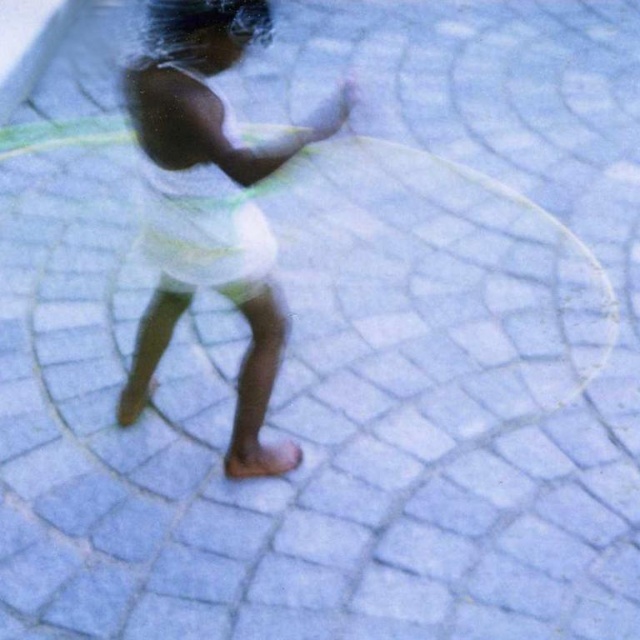
Does smooth white dress at center appear over white cotton dress at center?

No.

Locate an element on the screen. The image size is (640, 640). smooth white dress at center is located at coordinates click(x=205, y=88).

Locate an element on the screen. The image size is (640, 640). smooth white dress at center is located at coordinates (205, 88).